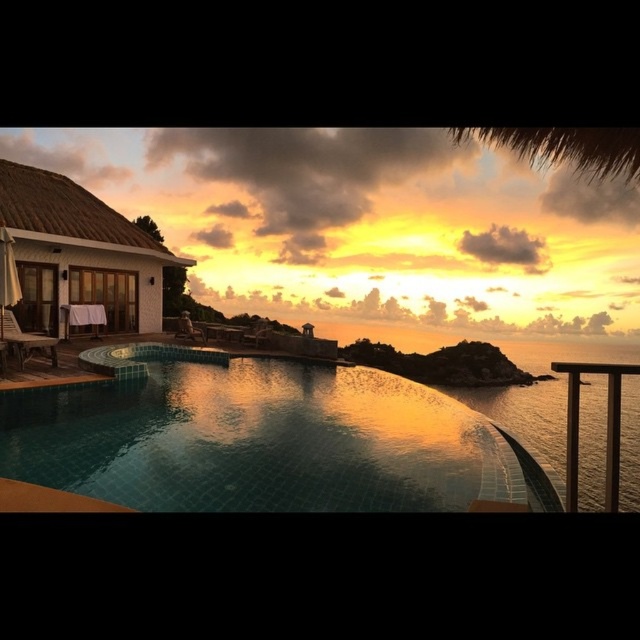
Question: Does tile mosaic pool at center have a smaller size compared to matte wood chair at lower left?

Choices:
 (A) yes
 (B) no

Answer: (B)

Question: Which object appears closest to the camera in this image?

Choices:
 (A) white textured hut at left
 (B) tile mosaic pool at center

Answer: (B)

Question: Is tile mosaic pool at center to the left of white textured hut at left from the viewer's perspective?

Choices:
 (A) yes
 (B) no

Answer: (B)

Question: Considering the real-world distances, which object is farthest from the tile mosaic pool at center?

Choices:
 (A) white textured hut at left
 (B) matte wood chair at lower left

Answer: (A)

Question: Can you confirm if tile mosaic pool at center is wider than matte wood chair at lower left?

Choices:
 (A) yes
 (B) no

Answer: (A)

Question: Which object is closer to the camera taking this photo?

Choices:
 (A) matte wood chair at lower left
 (B) white textured hut at left
 (C) tile mosaic pool at center

Answer: (C)